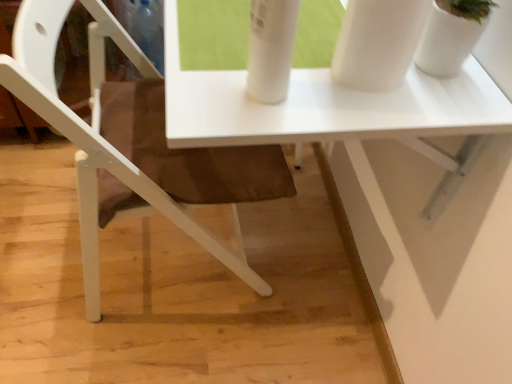
Locate an element on the screen. unoccupied region to the right of white matte chair at lower left is located at coordinates (306, 269).